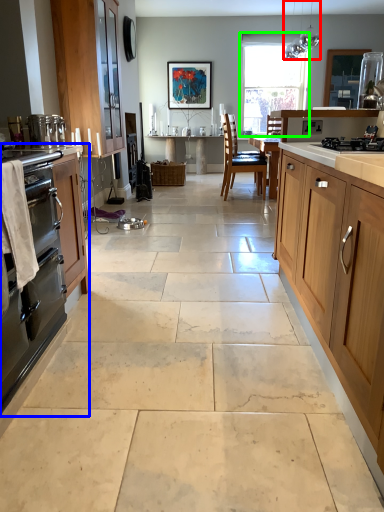
Question: Which object is positioned farthest from light fixture (highlighted by a red box)? Select from cabinetry (highlighted by a blue box) and window (highlighted by a green box).

Choices:
 (A) cabinetry
 (B) window

Answer: (A)